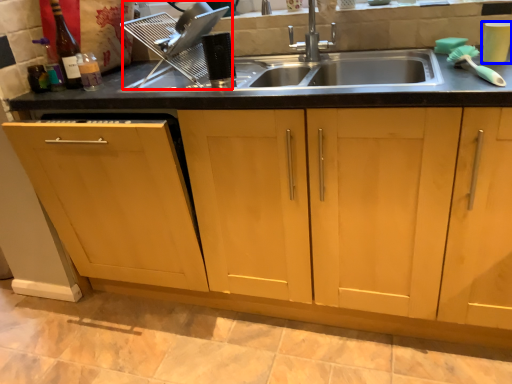
Question: Which point is closer to the camera, appliance (highlighted by a red box) or appliance (highlighted by a blue box)?

Choices:
 (A) appliance
 (B) appliance

Answer: (B)